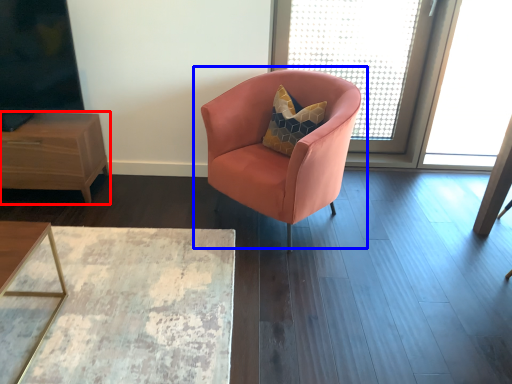
Question: Among these objects, which one is nearest to the camera, nightstand (highlighted by a red box) or chair (highlighted by a blue box)?

Choices:
 (A) nightstand
 (B) chair

Answer: (B)